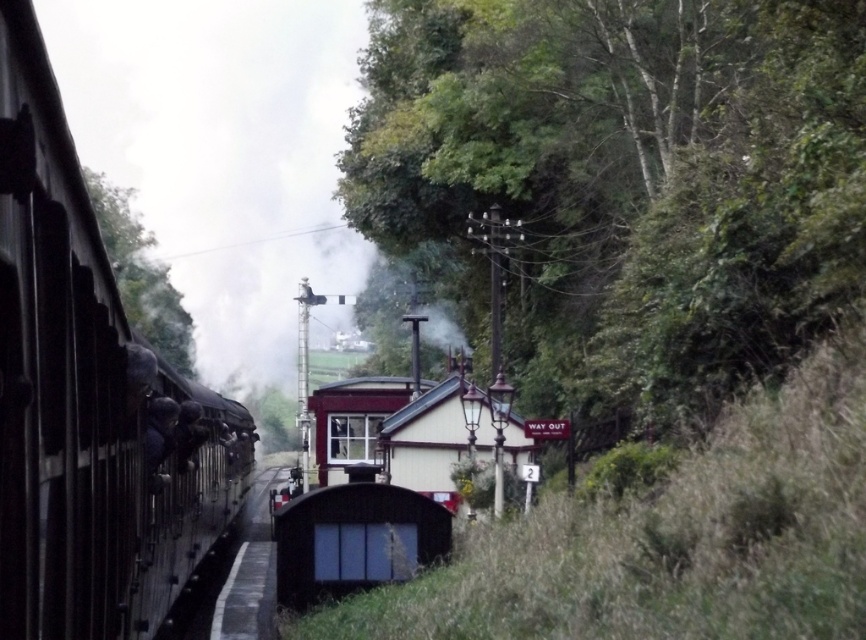
You are a passenger on the polished metal train at left and want to look out the window to see the green leafy tree at left. Based on their sizes, which object will appear larger in your view?

The green leafy tree at left will appear larger in your view because it is larger in size compared to the polished metal train at left.

You are a passenger on the black steam locomotive on the left. You notice a point marked at coordinates (627, 179) in the scene. What object is located at that point?

The point at coordinates (627, 179) indicates a green leafy tree at upper center.

You are a railway engineer inspecting the tracks at the railway station. You notice a point marked at coordinates (85, 397). Based on the scene description, what object does this point correspond to?

The point at coordinates (85, 397) corresponds to the polished metal train at left.